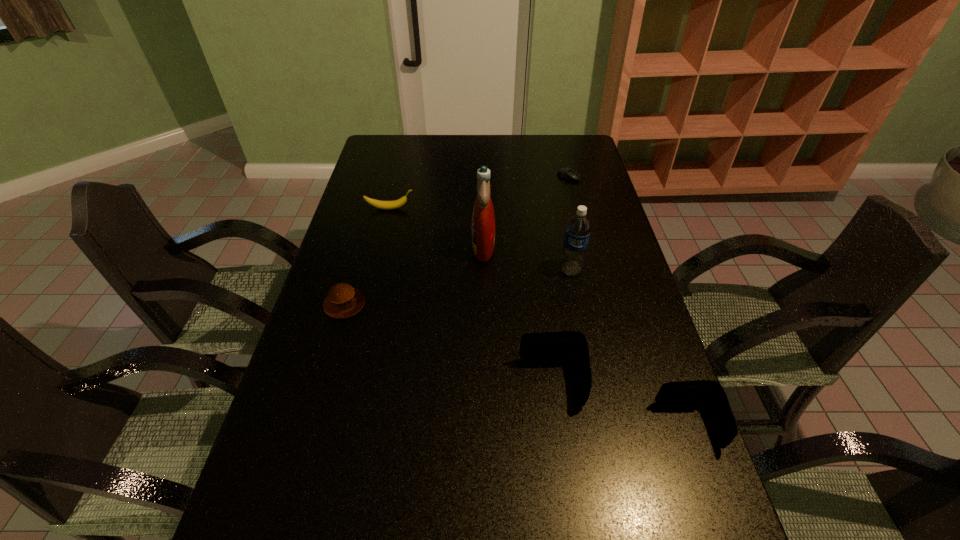
Find the location of a particular element. Image resolution: width=960 pixels, height=540 pixels. detergent is located at coordinates (483, 219).

The width and height of the screenshot is (960, 540). I want to click on the sixth nearest object, so click(387, 205).

I want to click on free spot located on the outer surface of the taller wallet, so click(423, 382).

Image resolution: width=960 pixels, height=540 pixels. In order to click on free space located on the outer surface of the taller wallet in this screenshot , I will do `click(364, 382)`.

In order to click on vacant point located 0.060m on the outer surface of the taller wallet in this screenshot , I will do `click(495, 382)`.

I want to click on free space located on the outer surface of the rightmost object, so click(532, 425).

Image resolution: width=960 pixels, height=540 pixels. Identify the location of blank space located on the outer surface of the rightmost object. (518, 425).

The height and width of the screenshot is (540, 960). Find the location of `vacant region located on the outer surface of the rightmost object`. vacant region located on the outer surface of the rightmost object is located at coordinates (540, 425).

This screenshot has height=540, width=960. In order to click on blank space located on the front of the third nearest object in this screenshot , I will do `click(311, 421)`.

The image size is (960, 540). Find the location of `free space located on the right of the shortest object`. free space located on the right of the shortest object is located at coordinates (597, 177).